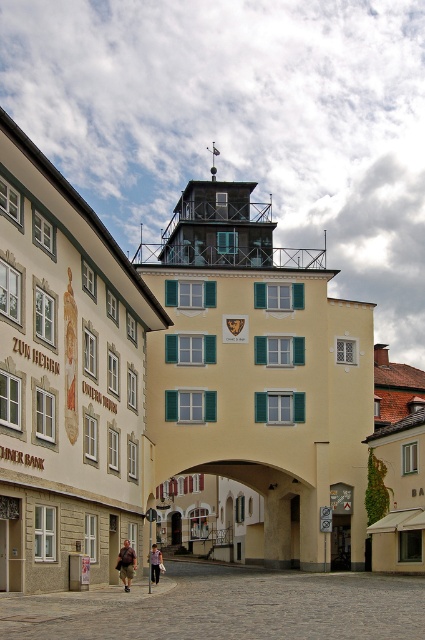
You are standing at the point marked as point (172, 390). The camera is 309.17 feet away from you. If you want to take a photo of the European building with the tower, which direction should you walk to get closer to the camera?

Since the camera is 309.17 feet away from you at point (172, 390), you should walk towards the camera to get closer to it for taking the photo.

You are a tourist standing in front of the European building. You see the matte black tower at upper center and the brown leather jacket at lower center. Which object is closer to you?

The brown leather jacket at lower center is behind the matte black tower at upper center, so the matte black tower at upper center is closer to you.